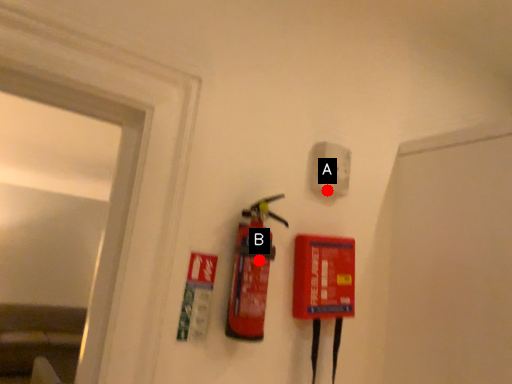
Question: Two points are circled on the image, labeled by A and B beside each circle. Among these points, which one is farthest from the camera?

Choices:
 (A) A is further
 (B) B is further

Answer: (A)